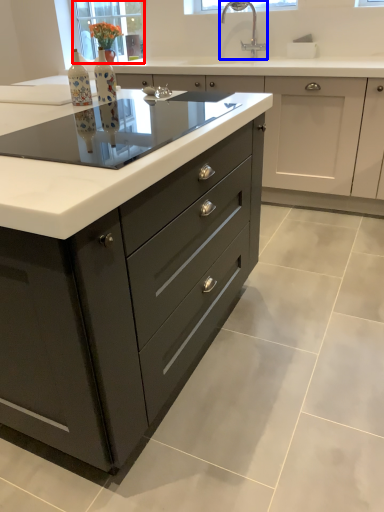
Question: Among these objects, which one is nearest to the camera, window screen (highlighted by a red box) or tap (highlighted by a blue box)?

Choices:
 (A) window screen
 (B) tap

Answer: (B)